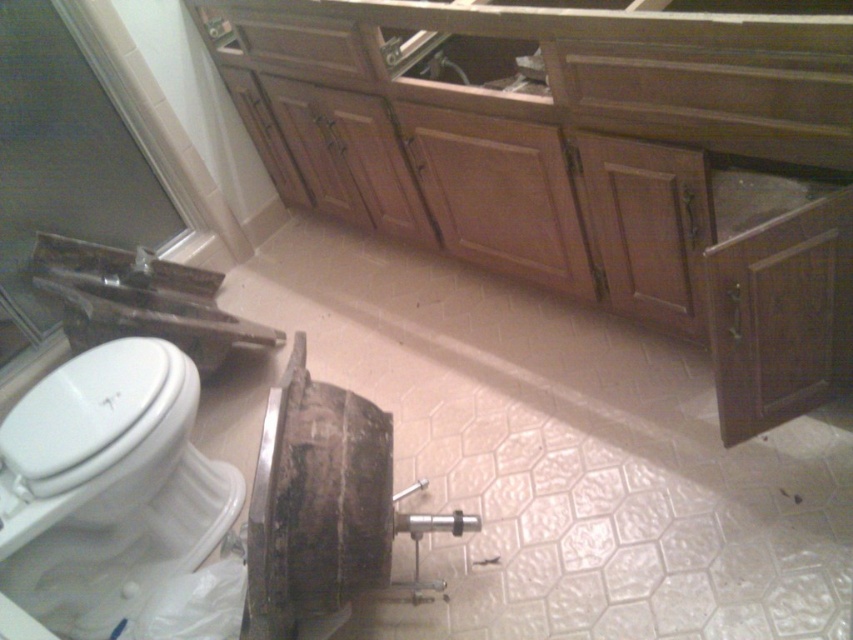
You are a contractor working in a bathroom renovation. You need to place a new rectangular shelf that is 2 feet wide. You have two options for placement next to the wooden cabinet at center and the metallic silver sink at left. Which object can accommodate the shelf based on their widths?

The wooden cabinet at center has a greater width than the metallic silver sink at left, so the shelf can be placed next to the wooden cabinet at center since it has enough space.

You are a contractor working in the bathroom and need to place a new fixture that requires a clear space of 1 meter in front of it. Given the wooden cabinet at center, is there enough space in front of it to install the fixture?

The wooden cabinet at center is located at point (584, 157). Since the coordinates indicate its position, but the exact dimensions and surrounding space aren